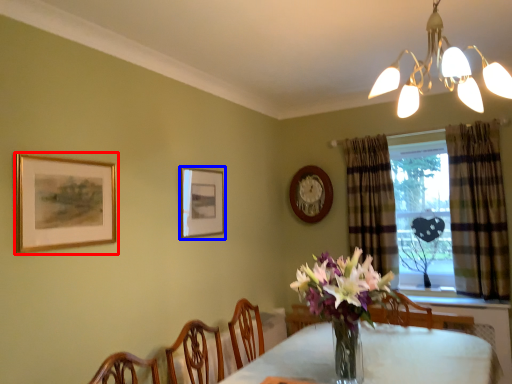
Question: Which point is further to the camera, picture frame (highlighted by a red box) or picture frame (highlighted by a blue box)?

Choices:
 (A) picture frame
 (B) picture frame

Answer: (B)